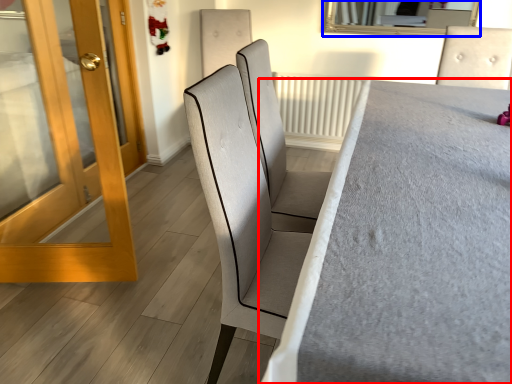
Question: Which object appears farthest to the camera in this image, furniture (highlighted by a red box) or mirror (highlighted by a blue box)?

Choices:
 (A) furniture
 (B) mirror

Answer: (B)